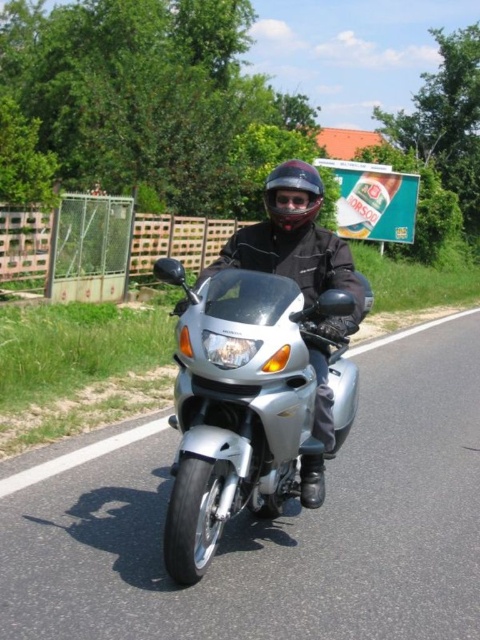
Is silver metallic motorcycle at center above glossy plastic goggles at center?

No.

Can you confirm if silver metallic motorcycle at center is wider than glossy plastic goggles at center?

Correct, the width of silver metallic motorcycle at center exceeds that of glossy plastic goggles at center.

Between point (445, 404) and point (312, 204), which one is positioned behind?

The point (445, 404) is behind.

Image resolution: width=480 pixels, height=640 pixels. In order to click on silver metallic motorcycle at center in this screenshot , I will do `click(266, 524)`.

Is matte black helmet at center wider than glossy plastic goggles at center?

Yes.

Describe the element at coordinates (294, 189) in the screenshot. I see `matte black helmet at center` at that location.

Does point (287, 182) come in front of point (272, 204)?

Yes.

Locate an element on the screen. Image resolution: width=480 pixels, height=640 pixels. matte black helmet at center is located at coordinates (294, 189).

Which is behind, point (84, 560) or point (278, 166)?

Positioned behind is point (278, 166).

Between point (91, 556) and point (311, 170), which one is positioned behind?

The point (311, 170) is behind.

Where is `silver metallic motorcycle at center`? The image size is (480, 640). silver metallic motorcycle at center is located at coordinates (266, 524).